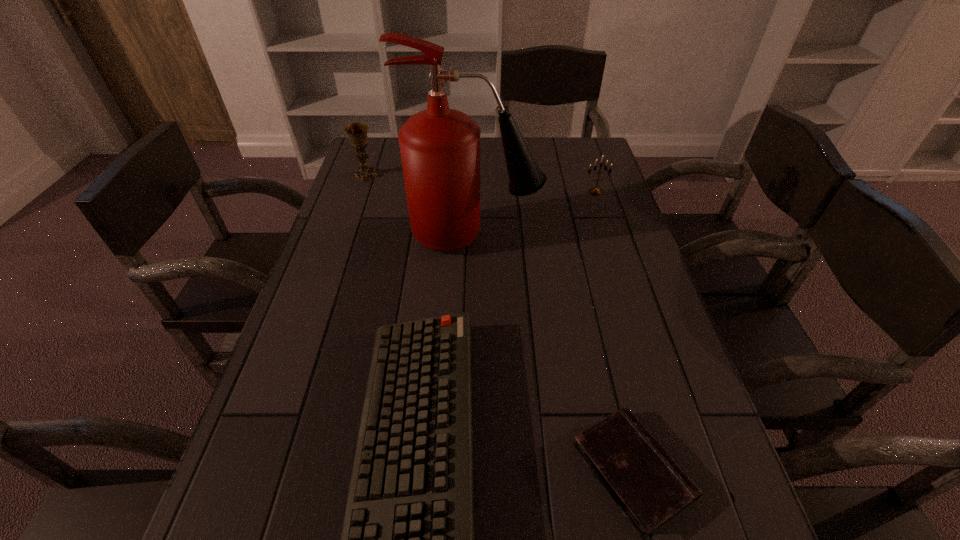
Where is `object present at the left edge`? This screenshot has height=540, width=960. object present at the left edge is located at coordinates (357, 132).

The image size is (960, 540). What are the coordinates of `object at the right edge` in the screenshot? It's located at (594, 191).

Find the location of a particular element. Image resolution: width=960 pixels, height=540 pixels. object situated at the far left corner is located at coordinates (357, 132).

Locate an element on the screen. Image resolution: width=960 pixels, height=540 pixels. vacant space at the far edge of the desktop is located at coordinates (544, 151).

The image size is (960, 540). Find the location of `free region at the left edge`. free region at the left edge is located at coordinates (261, 420).

At what (x,y) coordinates should I click in order to perform the action: click on vacant space at the right edge of the desktop. Please return your answer as a coordinate pair (x, y). The image size is (960, 540). Looking at the image, I should click on (612, 394).

At what (x,y) coordinates should I click in order to perform the action: click on the third closest object to the diary. Please return your answer as a coordinate pair (x, y). Image resolution: width=960 pixels, height=540 pixels. Looking at the image, I should click on (594, 191).

Where is `the second closest object to the shortest object`? Image resolution: width=960 pixels, height=540 pixels. the second closest object to the shortest object is located at coordinates (440, 147).